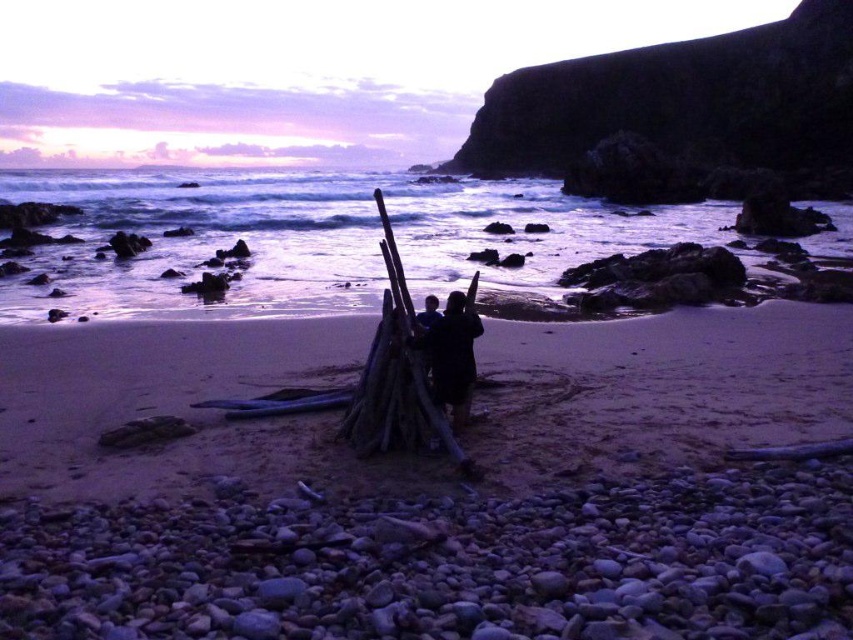
Question: Does smooth sand at center come in front of dark clothing at center?

Choices:
 (A) no
 (B) yes

Answer: (B)

Question: Does smooth sand at center appear over dark clothing at center?

Choices:
 (A) yes
 (B) no

Answer: (B)

Question: Does smooth sand at center come in front of dark clothing at center?

Choices:
 (A) yes
 (B) no

Answer: (A)

Question: Which object is closer to the camera taking this photo?

Choices:
 (A) smooth sand at center
 (B) dark clothing at center

Answer: (A)

Question: Among these points, which one is nearest to the camera?

Choices:
 (A) (229, 436)
 (B) (453, 316)

Answer: (B)

Question: Which of the following is the farthest from the observer?

Choices:
 (A) dark clothing at center
 (B) smooth sand at center

Answer: (A)